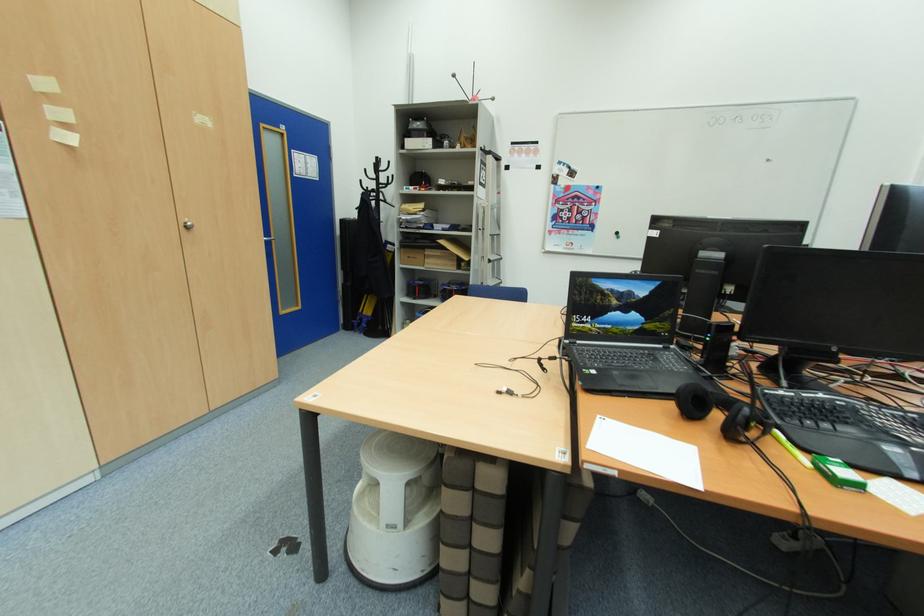
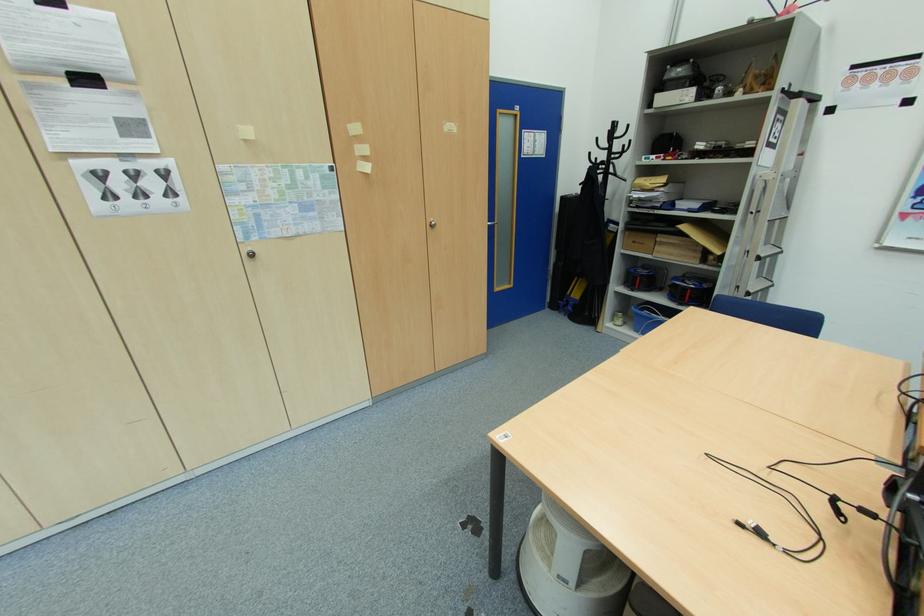
Find the pixel in the second image that matches (x=269, y=238) in the first image.

(493, 224)